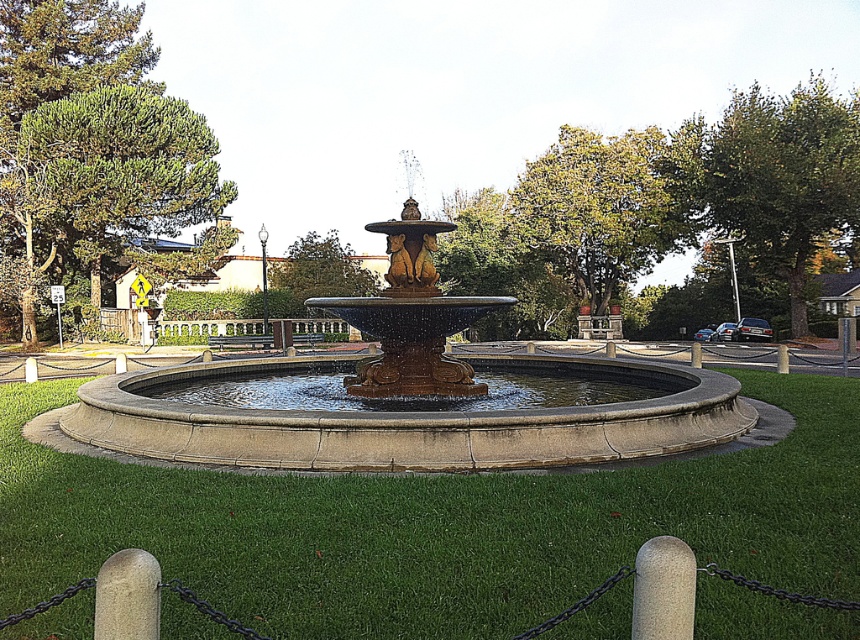
You are planning to place a new decorative statue in the green grass at center. Considering the space available, will the statue fit if it is the same size as the polished bronze fountain at center?

The green grass at center occupies less space than the polished bronze fountain at center. Therefore, the statue would not fit in the green grass at center if it is the same size as the polished bronze fountain at center.

You are standing in front of the fountain and want to step onto the green grass at center. Can you walk directly towards the polished bronze fountain at center and reach the grass without moving sideways?

Yes, because the green grass at center is closer to the viewer than the polished bronze fountain at center, so walking straight towards the fountain will lead you onto the grass first.

You are standing in the park and see the green grass at center and the polished bronze fountain at center. Which object is positioned to the left of the other?

The green grass at center is to the left of the polished bronze fountain at center.